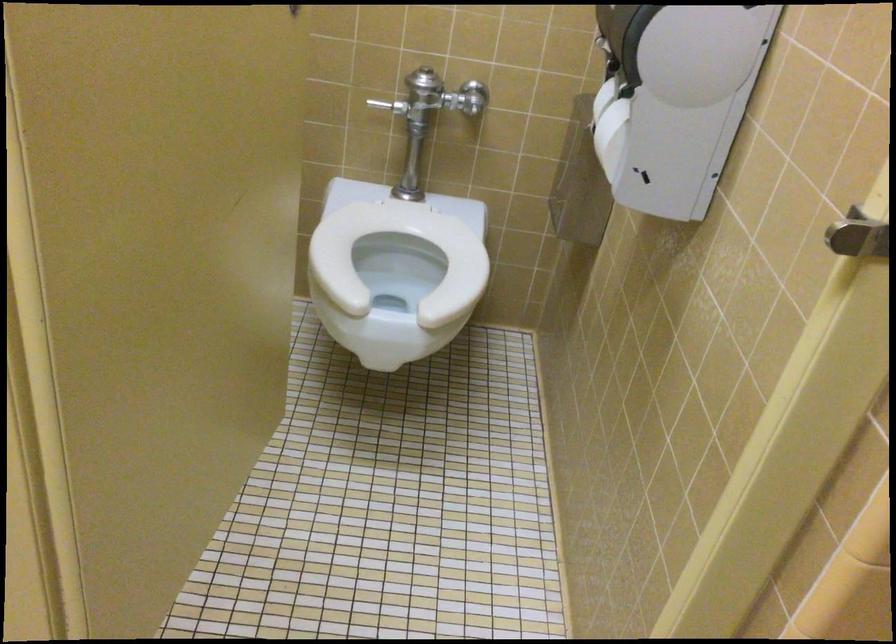
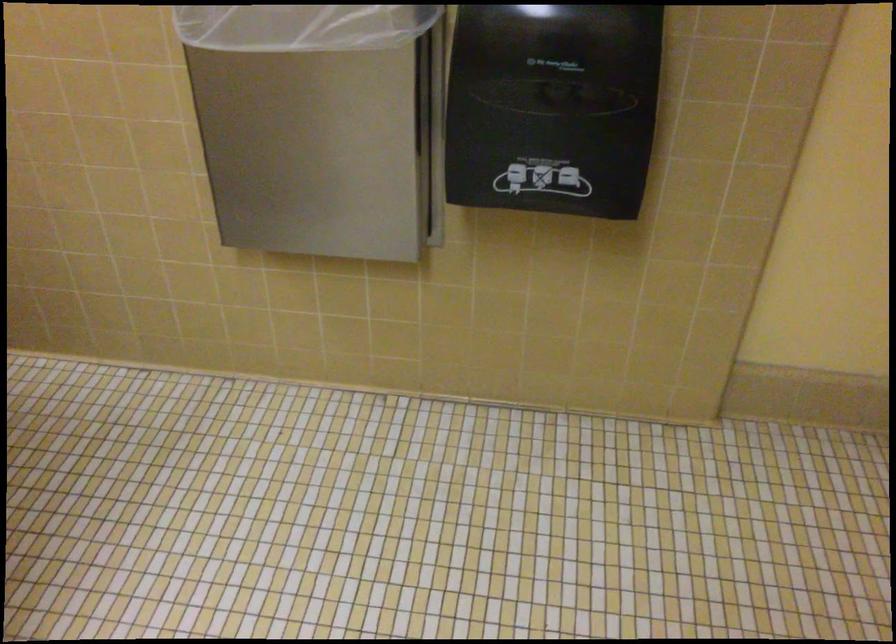
The images are taken continuously from a first-person perspective. In which direction is your viewpoint rotating?

The camera's rotation is toward right-down.